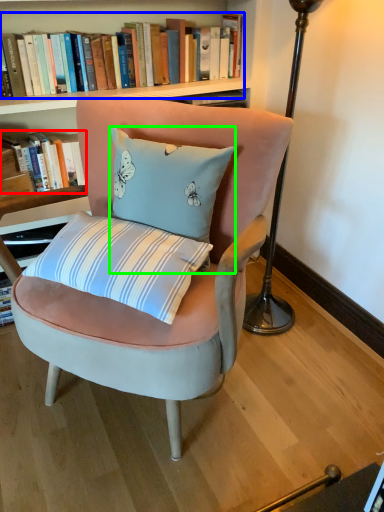
Question: Considering the real-world distances, which object is farthest from book (highlighted by a red box)? book (highlighted by a blue box) or pillow (highlighted by a green box)?

Choices:
 (A) book
 (B) pillow

Answer: (B)